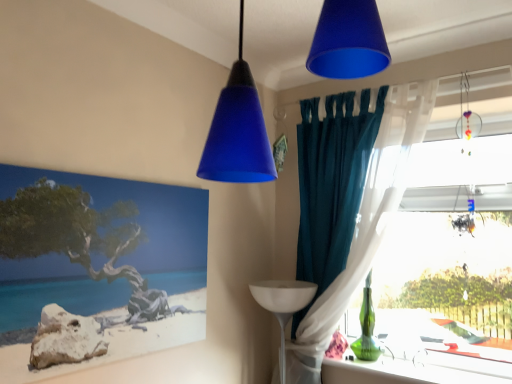
Question: From a real-world perspective, is matte canvas painting at left under teal fabric curtain at right?

Choices:
 (A) no
 (B) yes

Answer: (B)

Question: Is the depth of matte canvas painting at left less than that of teal fabric curtain at right?

Choices:
 (A) no
 (B) yes

Answer: (B)

Question: Is matte canvas painting at left with teal fabric curtain at right?

Choices:
 (A) no
 (B) yes

Answer: (A)

Question: From the image's perspective, is matte canvas painting at left over teal fabric curtain at right?

Choices:
 (A) no
 (B) yes

Answer: (A)

Question: Is matte canvas painting at left located outside teal fabric curtain at right?

Choices:
 (A) yes
 (B) no

Answer: (A)

Question: Would you say matte canvas painting at left is inside or outside matte blue cone at upper center, acting as the 1th lamp starting from the front?

Choices:
 (A) inside
 (B) outside

Answer: (B)

Question: Is matte canvas painting at left taller or shorter than matte blue cone at upper center, acting as the second lamp starting from the back?

Choices:
 (A) tall
 (B) short

Answer: (A)

Question: Is point (74, 296) positioned closer to the camera than point (229, 155)?

Choices:
 (A) closer
 (B) farther

Answer: (B)

Question: Based on their positions, is matte canvas painting at left located to the left or right of matte blue cone at upper center, acting as the 1th lamp starting from the front?

Choices:
 (A) right
 (B) left

Answer: (B)

Question: Do you think transparent glass table at right is within translucent glass ornament at upper right, which appears as the 2th lamp when viewed from the left, or outside of it?

Choices:
 (A) inside
 (B) outside

Answer: (B)

Question: From a real-world perspective, is transparent glass table at right above or below translucent glass ornament at upper right, which ranks as the 1th lamp in back-to-front order?

Choices:
 (A) below
 (B) above

Answer: (A)

Question: Visually, is transparent glass table at right positioned to the left or to the right of translucent glass ornament at upper right, the 1th lamp viewed from the right?

Choices:
 (A) right
 (B) left

Answer: (B)

Question: Does point (434, 360) appear closer or farther from the camera than point (453, 221)?

Choices:
 (A) farther
 (B) closer

Answer: (A)

Question: From their relative heights in the image, would you say teal fabric curtain at right is taller or shorter than white glossy table lamp at lower right?

Choices:
 (A) tall
 (B) short

Answer: (A)

Question: Is point (320, 362) closer or farther from the camera than point (288, 317)?

Choices:
 (A) closer
 (B) farther

Answer: (A)